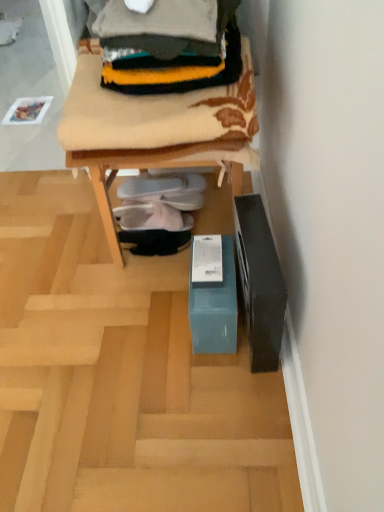
The height and width of the screenshot is (512, 384). In order to click on blank space situated above black suede shoes at center, the first footwear ordered from the bottom (from a real-world perspective) in this screenshot , I will do `click(152, 232)`.